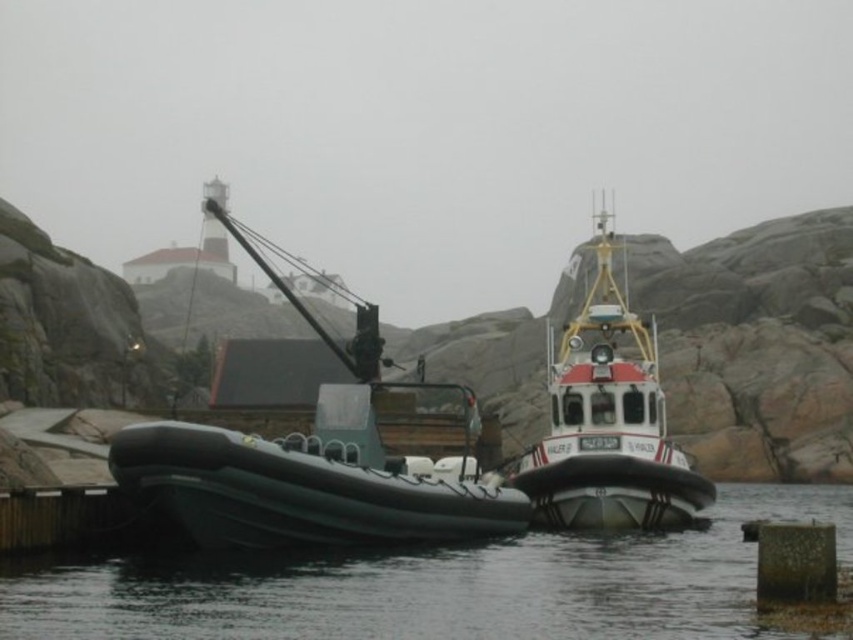
You are a marine biologist observing two boats in a harbor. You need to board the green rubber boat at center first before moving to the red and white rubber boat at center. Based on their positions, which boat should you approach first from the dock?

The green rubber boat at center is located below the red and white rubber boat at center, so you should approach the green rubber boat at center first as it is closer to the dock.